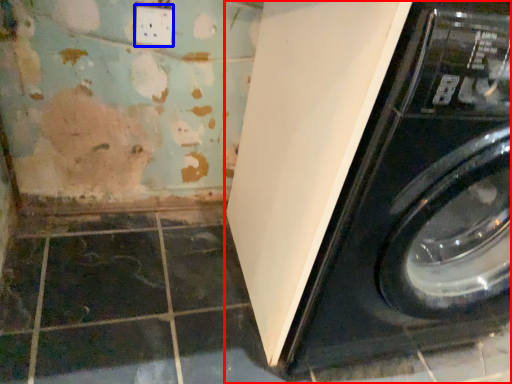
Question: Which object is further to the camera taking this photo, washing machine (highlighted by a red box) or electric outlet (highlighted by a blue box)?

Choices:
 (A) washing machine
 (B) electric outlet

Answer: (B)